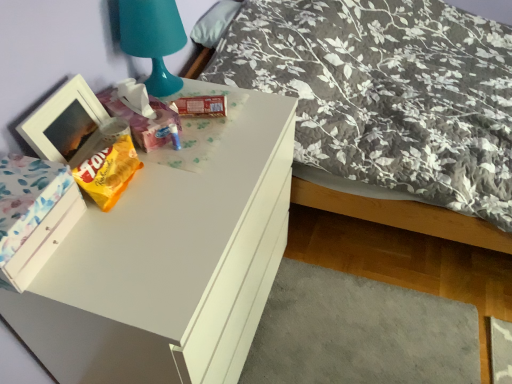
Where is `vacant area on top of fluffy gray pillow at upper center (from a real-world perspective)`? vacant area on top of fluffy gray pillow at upper center (from a real-world perspective) is located at coordinates (216, 20).